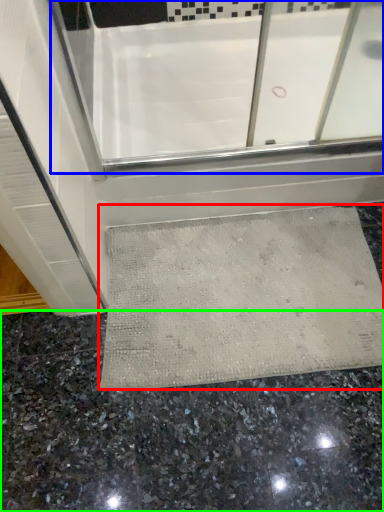
Question: Which is nearer to the bath mat (highlighted by a red box)? bath (highlighted by a blue box) or granite (highlighted by a green box).

Choices:
 (A) bath
 (B) granite

Answer: (B)